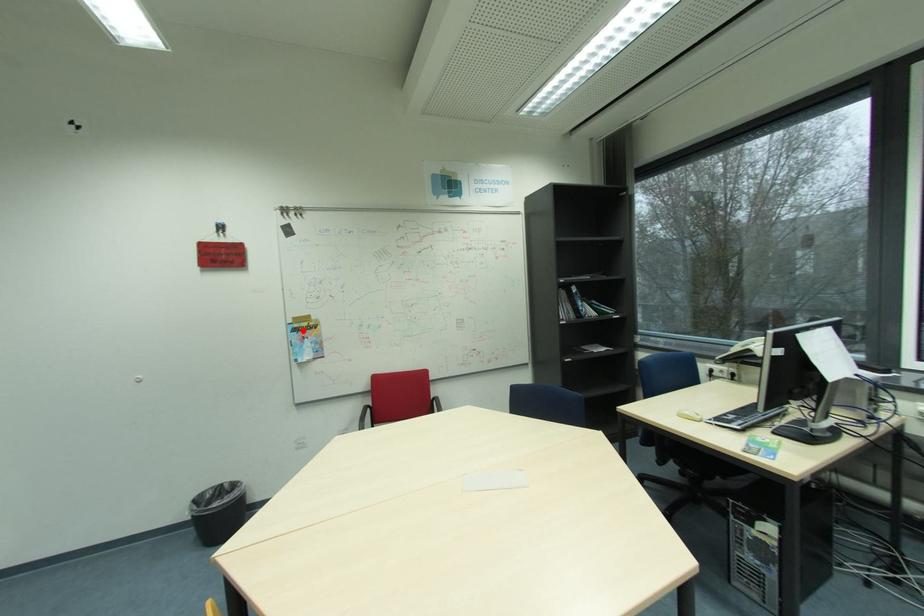
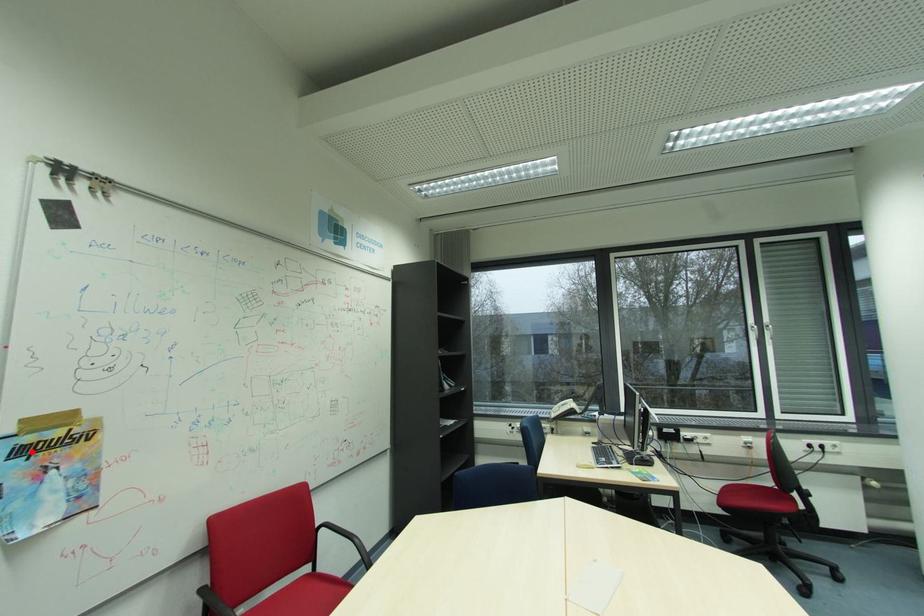
I am providing you with two images of the same scene from different viewpoints. A red point is marked on the first image and another point is marked on the second image. Does the point marked in image1 correspond to the same location as the one in image2?

Yes